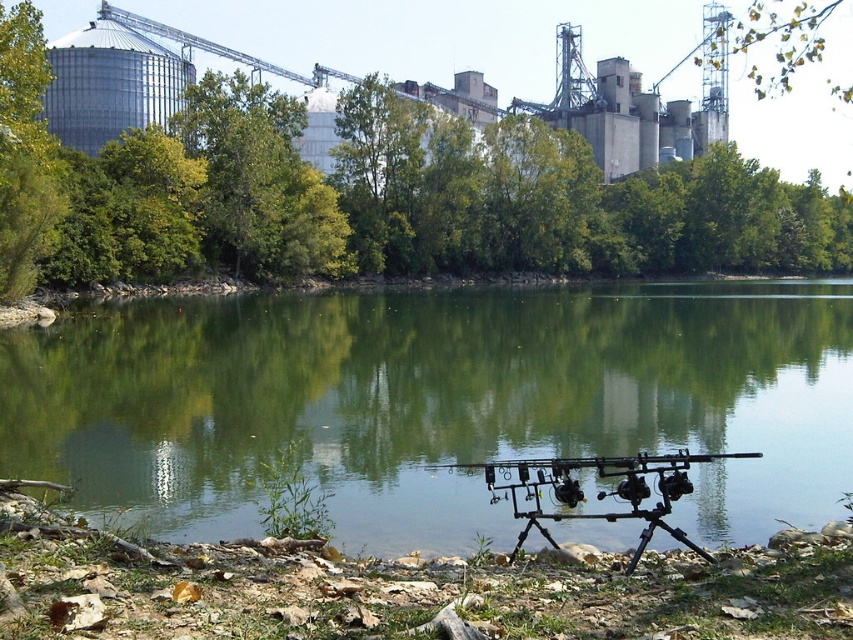
You are a photographer setting up equipment in the riverside scene. You have a black matte tripod at center and a green leafy tree at upper center in your view. Which object appears narrower in your frame?

The black matte tripod at center appears narrower in the frame because it is thinner than the green leafy tree at upper center.

You are standing at the point marked as point (390, 202) in the image. What type of object are you currently standing on?

You are standing on a green leafy tree at center.

You are a photographer setting up equipment at the riverside. You have a black matte tripod at center and a green leafy tree at upper center in your view. Which object is positioned lower from your perspective?

The black matte tripod at center is positioned lower than the green leafy tree at upper center.